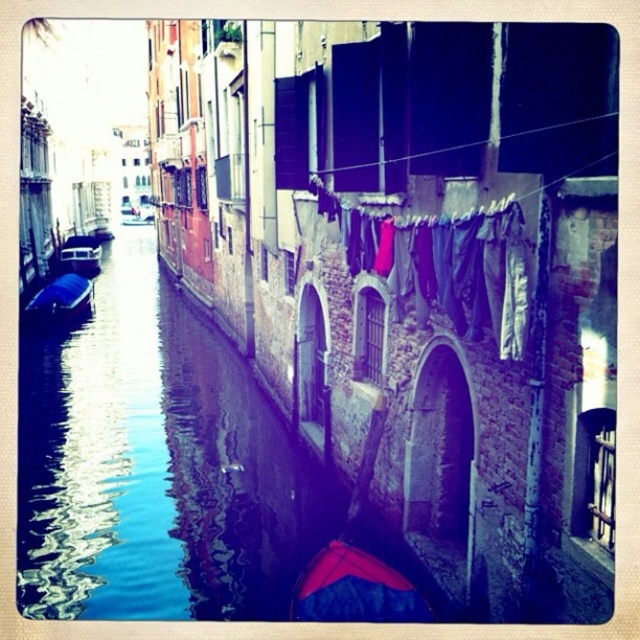
You are a tourist standing on the canal bridge and want to take a photo of both the red fabric boat at lower center and the matte black boat at left. Which boat should you adjust your camera angle to capture first if you want to include both in the frame without moving your position?

The red fabric boat at lower center has a lesser height compared to the matte black boat at left, so you should adjust your camera angle to capture the taller matte black boat at left first to ensure both are in the frame.

You are standing at the edge of the canal and want to take a photo that includes both the historic buildings and the colorful clothes hanging from the balconies. Which point, point [353,608] or point [84,266], is closer to you and should be prioritized in your composition to ensure clarity?

Point [353,608] is closer to the viewer than point [84,266], so it should be prioritized in the composition to ensure clarity.